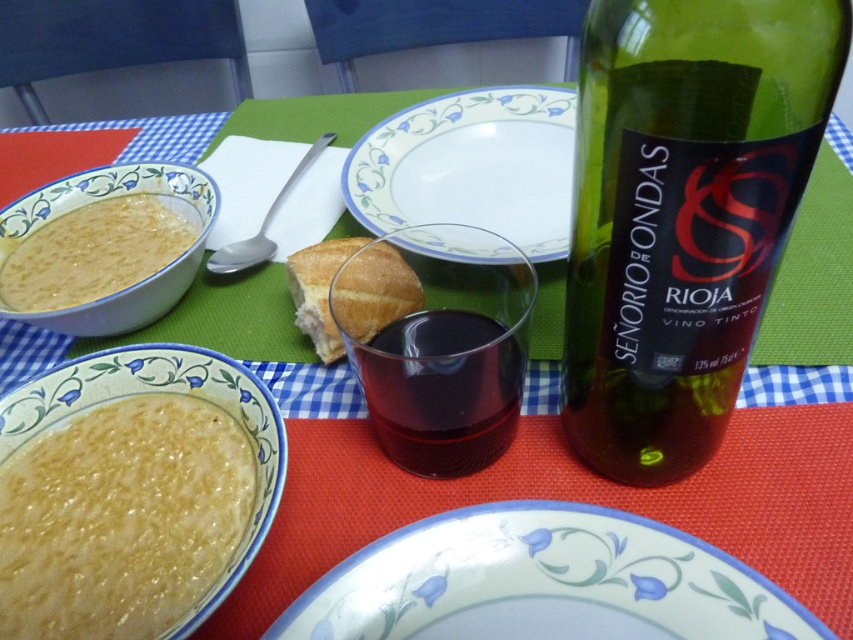
You are a waiter standing at the edge of the table. You need to reach the green glass bottle at upper right to pour wine for the guests. Considering your arm can extend 2 feet, can you reach it?

The distance of green glass bottle at upper right from camera is 5.73 inches, which is less than 2 feet. Therefore, you can easily reach the green glass bottle at upper right with your arm.

You are a guest at a dinner table with the dark red glass at center and the white glossy bowl at left in front of you. You need to choose a container to hold a spoon. Which one is taller so it can accommodate the spoon without spilling?

The white glossy bowl at left is taller than the dark red glass at center, so it is better suited to hold the spoon without spilling.